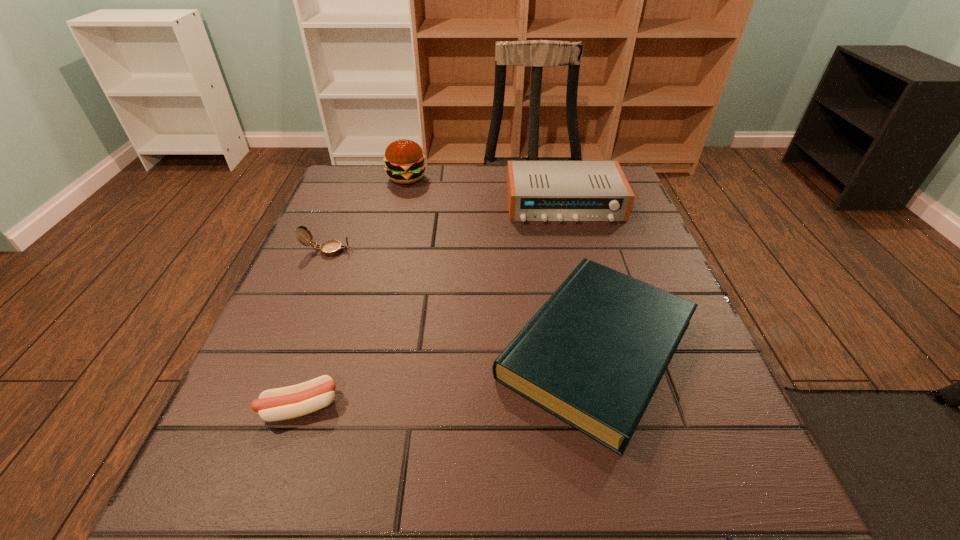
What are the coordinates of `vacant space that satisfies the following two spatial constraints: 1. on the face of the compass; 2. on the right side of the shortest object` in the screenshot? It's located at (263, 407).